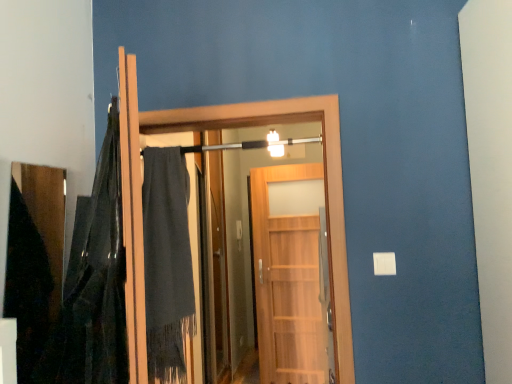
Question: Could you tell me if wooden door at center, which is the first door from front to back, is turned towards wooden door at center, marked as the 2th door in a front-to-back arrangement?

Choices:
 (A) yes
 (B) no

Answer: (B)

Question: From a real-world perspective, is wooden door at center, which is the 2th door from back to front, over wooden door at center, marked as the 1th door in a back-to-front arrangement?

Choices:
 (A) no
 (B) yes

Answer: (B)

Question: Are wooden door at center, which is the first door from front to back, and wooden door at center, marked as the 2th door in a front-to-back arrangement, located far from each other?

Choices:
 (A) yes
 (B) no

Answer: (A)

Question: Considering the relative sizes of wooden door at center, which is the 2th door from back to front, and wooden door at center, marked as the 2th door in a front-to-back arrangement, in the image provided, is wooden door at center, which is the 2th door from back to front, shorter than wooden door at center, marked as the 2th door in a front-to-back arrangement,?

Choices:
 (A) yes
 (B) no

Answer: (A)

Question: Is wooden door at center, which is the first door from front to back, to the right of wooden door at center, marked as the 1th door in a back-to-front arrangement, from the viewer's perspective?

Choices:
 (A) no
 (B) yes

Answer: (A)

Question: Considering the relative positions of dark gray woolen robe at center and wooden door at center, which is the 2th door from back to front, in the image provided, is dark gray woolen robe at center to the left or to the right of wooden door at center, which is the 2th door from back to front,?

Choices:
 (A) left
 (B) right

Answer: (A)

Question: Is dark gray woolen robe at center in front of or behind wooden door at center, which is the 2th door from back to front, in the image?

Choices:
 (A) front
 (B) behind

Answer: (B)

Question: Is dark gray woolen robe at center spatially inside wooden door at center, which is the 2th door from back to front, or outside of it?

Choices:
 (A) inside
 (B) outside

Answer: (A)

Question: From the image's perspective, is dark gray woolen robe at center above or below wooden door at center, which is the 2th door from back to front?

Choices:
 (A) above
 (B) below

Answer: (B)

Question: Visually, is wooden door at center, marked as the 1th door in a back-to-front arrangement, positioned to the left or to the right of wooden door at center, which is the 2th door from back to front?

Choices:
 (A) right
 (B) left

Answer: (A)

Question: Is point (284, 264) closer or farther from the camera than point (133, 112)?

Choices:
 (A) closer
 (B) farther

Answer: (B)

Question: In terms of width, does wooden door at center, marked as the 1th door in a back-to-front arrangement, look wider or thinner when compared to wooden door at center, which is the first door from front to back?

Choices:
 (A) thin
 (B) wide

Answer: (A)

Question: Relative to wooden door at center, which is the first door from front to back, is wooden door at center, marked as the 2th door in a front-to-back arrangement, in front or behind?

Choices:
 (A) front
 (B) behind

Answer: (B)

Question: Is dark gray woolen robe at center bigger or smaller than wooden door at center, marked as the 2th door in a front-to-back arrangement?

Choices:
 (A) big
 (B) small

Answer: (B)

Question: Is dark gray woolen robe at center taller or shorter than wooden door at center, marked as the 1th door in a back-to-front arrangement?

Choices:
 (A) short
 (B) tall

Answer: (A)